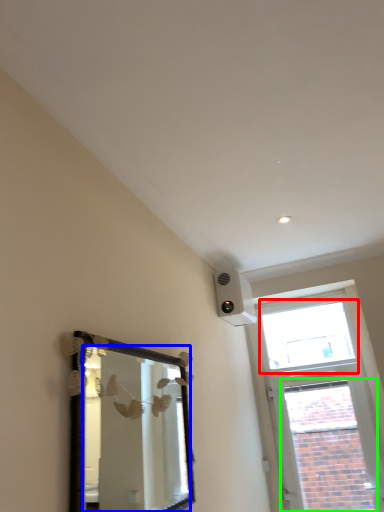
Question: Which object is the farthest from window (highlighted by a red box)? Choose among these: mirror (highlighted by a blue box) or window (highlighted by a green box).

Choices:
 (A) mirror
 (B) window

Answer: (A)